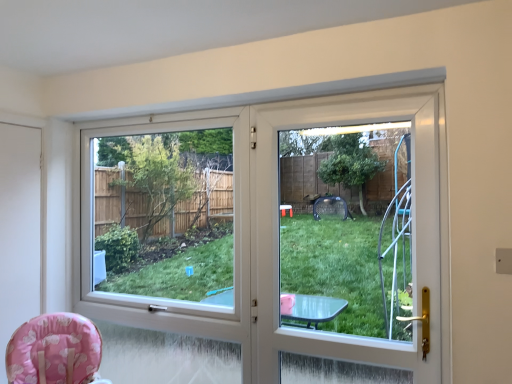
This screenshot has height=384, width=512. Describe the element at coordinates (19, 230) in the screenshot. I see `white matte screen door at left, positioned as the second screen door in right-to-left order` at that location.

Identify the location of transparent plastic window screen at center. The width and height of the screenshot is (512, 384). (160, 214).

Looking at their sizes, would you say white matte screen door at left, marked as the first screen door in a back-to-front arrangement, is wider or thinner than white plastic screen door at center, which appears as the 1th screen door when viewed from the right?

In the image, white matte screen door at left, marked as the first screen door in a back-to-front arrangement, appears to be more narrow than white plastic screen door at center, which appears as the 1th screen door when viewed from the right.

From the picture: Is white matte screen door at left, positioned as the second screen door in right-to-left order, oriented towards white plastic screen door at center, which appears as the 1th screen door when viewed from the right?

No.

From the image's perspective, between white matte screen door at left, which appears as the 1th screen door when viewed from the left, and white plastic screen door at center, acting as the second screen door starting from the left, which one is located above?

white plastic screen door at center, acting as the second screen door starting from the left.

Does point (36, 168) come in front of point (260, 133)?

No, it is behind (260, 133).

From a real-world perspective, is transparent plastic window screen at center on top of pink fabric baby chair at lower left?

Yes, from a real-world perspective, transparent plastic window screen at center is over pink fabric baby chair at lower left

From the image's perspective, is transparent plastic window screen at center located beneath pink fabric baby chair at lower left?

No, from the image's perspective, transparent plastic window screen at center is not below pink fabric baby chair at lower left.

Does transparent plastic window screen at center have a smaller size compared to pink fabric baby chair at lower left?

No.

Could you tell me if transparent plastic window screen at center is facing pink fabric baby chair at lower left?

Yes, transparent plastic window screen at center faces towards pink fabric baby chair at lower left.

How different are the orientations of pink fabric baby chair at lower left and white plastic screen door at center, acting as the 2th screen door starting from the back, in degrees?

The angular difference between pink fabric baby chair at lower left and white plastic screen door at center, acting as the 2th screen door starting from the back, is 47.5 degrees.

Considering the sizes of objects pink fabric baby chair at lower left and white plastic screen door at center, acting as the second screen door starting from the left, in the image provided, who is bigger, pink fabric baby chair at lower left or white plastic screen door at center, acting as the second screen door starting from the left,?

pink fabric baby chair at lower left.

Between pink fabric baby chair at lower left and white plastic screen door at center, which appears as the 1th screen door when viewed from the right, which one has smaller width?

white plastic screen door at center, which appears as the 1th screen door when viewed from the right.

Considering their positions, is transparent plastic window screen at center located in front of or behind white plastic screen door at center, placed as the first screen door when sorted from front to back?

transparent plastic window screen at center is behind white plastic screen door at center, placed as the first screen door when sorted from front to back.

The height and width of the screenshot is (384, 512). I want to click on screen door in front of the transparent plastic window screen at center, so click(x=413, y=227).

Are transparent plastic window screen at center and white plastic screen door at center, acting as the second screen door starting from the left, making contact?

transparent plastic window screen at center is not next to white plastic screen door at center, acting as the second screen door starting from the left, and they're not touching.

Who is smaller, transparent plastic window screen at center or white plastic screen door at center, which appears as the 1th screen door when viewed from the right?

white plastic screen door at center, which appears as the 1th screen door when viewed from the right, is smaller.

The image size is (512, 384). In order to click on screen door in front of the transparent plastic window screen at center in this screenshot , I will do `click(413, 227)`.

From a real-world perspective, between white plastic screen door at center, acting as the second screen door starting from the left, and transparent plastic window screen at center, who is vertically higher?

white plastic screen door at center, acting as the second screen door starting from the left, is physically above.

Is white plastic screen door at center, acting as the 2th screen door starting from the back, aimed at transparent plastic window screen at center?

No, white plastic screen door at center, acting as the 2th screen door starting from the back, does not turn towards transparent plastic window screen at center.

Is white plastic screen door at center, which appears as the 1th screen door when viewed from the right, shorter than transparent plastic window screen at center?

Yes.

Is point (182, 244) less distant than point (3, 333)?

No, it is not.

Does transparent plastic window screen at center have a lesser height compared to white matte screen door at left, which appears as the 1th screen door when viewed from the left?

No, transparent plastic window screen at center is not shorter than white matte screen door at left, which appears as the 1th screen door when viewed from the left.

Is transparent plastic window screen at center looking in the opposite direction of white matte screen door at left, positioned as the second screen door in right-to-left order?

That's not correct — transparent plastic window screen at center is not looking away from white matte screen door at left, positioned as the second screen door in right-to-left order.

From a real-world perspective, is transparent plastic window screen at center above or below white matte screen door at left, which is the 2th screen door from front to back?

Clearly, from a real-world perspective, transparent plastic window screen at center is below white matte screen door at left, which is the 2th screen door from front to back.

In terms of width, does pink fabric baby chair at lower left look wider or thinner when compared to transparent plastic window screen at center?

Considering their sizes, pink fabric baby chair at lower left looks broader than transparent plastic window screen at center.

How different are the orientations of pink fabric baby chair at lower left and transparent plastic window screen at center in degrees?

47.5 degrees.

Could you tell me if pink fabric baby chair at lower left is facing transparent plastic window screen at center?

No.

Considering the sizes of objects pink fabric baby chair at lower left and transparent plastic window screen at center in the image provided, who is shorter, pink fabric baby chair at lower left or transparent plastic window screen at center?

pink fabric baby chair at lower left is shorter.

Where is `screen door that is below the white plastic screen door at center, which appears as the 1th screen door when viewed from the right (from the image's perspective)`? The height and width of the screenshot is (384, 512). screen door that is below the white plastic screen door at center, which appears as the 1th screen door when viewed from the right (from the image's perspective) is located at coordinates (19, 230).

In order to click on chair on the left of transparent plastic window screen at center in this screenshot , I will do `click(54, 350)`.

Which object lies nearer to the anchor point transparent plastic window screen at center, white plastic screen door at center, acting as the 2th screen door starting from the back, or white matte screen door at left, marked as the first screen door in a back-to-front arrangement?

white matte screen door at left, marked as the first screen door in a back-to-front arrangement, lies closer to transparent plastic window screen at center than the other object.

When comparing their distances from pink fabric baby chair at lower left, does white plastic screen door at center, placed as the first screen door when sorted from front to back, or transparent plastic window screen at center seem further?

transparent plastic window screen at center is positioned further to the anchor pink fabric baby chair at lower left.

Considering their positions, is transparent plastic window screen at center positioned closer to white plastic screen door at center, acting as the 2th screen door starting from the back, than pink fabric baby chair at lower left?

pink fabric baby chair at lower left lies closer to white plastic screen door at center, acting as the 2th screen door starting from the back, than the other object.

In the scene shown: Estimate the real-world distances between objects in this image. Which object is further from transparent plastic window screen at center, white matte screen door at left, marked as the first screen door in a back-to-front arrangement, or pink fabric baby chair at lower left?

Among the two, pink fabric baby chair at lower left is located further to transparent plastic window screen at center.

In the scene shown: Considering their positions, is transparent plastic window screen at center positioned closer to white plastic screen door at center, acting as the second screen door starting from the left, than white matte screen door at left, positioned as the second screen door in right-to-left order?

white matte screen door at left, positioned as the second screen door in right-to-left order.

Looking at the image, which one is located further to white plastic screen door at center, placed as the first screen door when sorted from front to back, pink fabric baby chair at lower left or transparent plastic window screen at center?

The object further to white plastic screen door at center, placed as the first screen door when sorted from front to back, is transparent plastic window screen at center.

Which object lies nearer to the anchor point transparent plastic window screen at center, white plastic screen door at center, placed as the first screen door when sorted from front to back, or pink fabric baby chair at lower left?

Among the two, pink fabric baby chair at lower left is located nearer to transparent plastic window screen at center.

When comparing their distances from pink fabric baby chair at lower left, does transparent plastic window screen at center or white plastic screen door at center, placed as the first screen door when sorted from front to back, seem further?

transparent plastic window screen at center.

The height and width of the screenshot is (384, 512). Identify the location of chair situated between white matte screen door at left, which appears as the 1th screen door when viewed from the left, and white plastic screen door at center, placed as the first screen door when sorted from front to back, from left to right. (54, 350).

In order to click on window screen between pink fabric baby chair at lower left and white plastic screen door at center, acting as the second screen door starting from the left, in the horizontal direction in this screenshot , I will do `click(160, 214)`.

Locate an element on the screen. The width and height of the screenshot is (512, 384). window screen between pink fabric baby chair at lower left and white matte screen door at left, positioned as the second screen door in right-to-left order, along the z-axis is located at coordinates (160, 214).

At what (x,y) coordinates should I click in order to perform the action: click on window screen located between white matte screen door at left, positioned as the second screen door in right-to-left order, and white plastic screen door at center, which appears as the 1th screen door when viewed from the right, in the left-right direction. Please return your answer as a coordinate pair (x, y). This screenshot has height=384, width=512. Looking at the image, I should click on (160, 214).